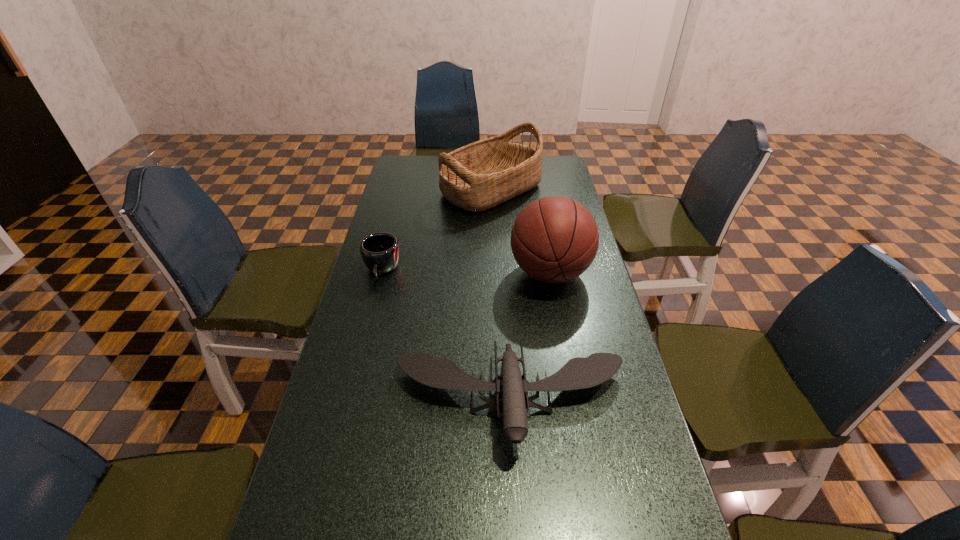
Locate an element on the screen. The height and width of the screenshot is (540, 960). empty location between the basketball and the drone is located at coordinates (530, 336).

Identify the location of free space between the leftmost object and the nearest object. Image resolution: width=960 pixels, height=540 pixels. (446, 335).

Find the location of `vacant region between the leftmost object and the basketball`. vacant region between the leftmost object and the basketball is located at coordinates (466, 272).

Locate an element on the screen. free space that is in between the tallest object and the nearest object is located at coordinates tap(530, 336).

Locate an element on the screen. the third closest object relative to the third shortest object is located at coordinates (578, 373).

Identify which object is located as the nearest to the mug. Please provide its 2D coordinates. Your answer should be formatted as a tuple, i.e. [(x, y)], where the tuple contains the x and y coordinates of a point satisfying the conditions above.

[(578, 373)]

Locate an element on the screen. The image size is (960, 540). free space that satisfies the following two spatial constraints: 1. on the side of the mug with the handle; 2. on the right side of the basketball is located at coordinates (381, 273).